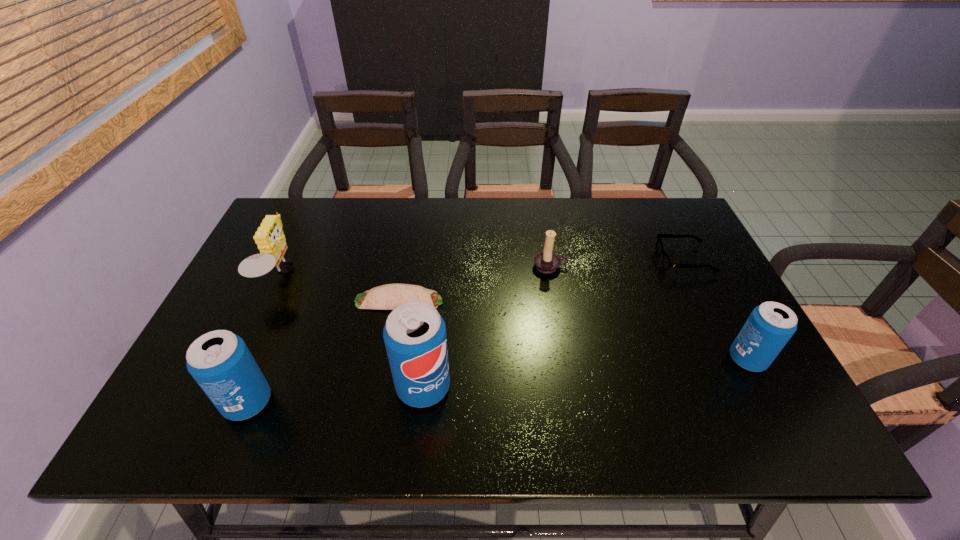
The height and width of the screenshot is (540, 960). In order to click on soda can identified as the second closest to the rightmost soda can in this screenshot , I will do `click(220, 362)`.

Identify which soda can is located as the second nearest to the burrito. Please provide its 2D coordinates. Your answer should be formatted as a tuple, i.e. [(x, y)], where the tuple contains the x and y coordinates of a point satisfying the conditions above.

[(220, 362)]

Where is `vacant space that satisfies the following two spatial constraints: 1. on the back side of the shortest soda can; 2. on the left side of the second soda can from right to left`? The width and height of the screenshot is (960, 540). vacant space that satisfies the following two spatial constraints: 1. on the back side of the shortest soda can; 2. on the left side of the second soda can from right to left is located at coordinates (426, 359).

Where is `free region that satisfies the following two spatial constraints: 1. on the wick of the candle holder; 2. at the bitten end of the shortest object`? Image resolution: width=960 pixels, height=540 pixels. free region that satisfies the following two spatial constraints: 1. on the wick of the candle holder; 2. at the bitten end of the shortest object is located at coordinates (556, 301).

Locate an element on the screen. vacant region that satisfies the following two spatial constraints: 1. on the wick of the fifth object from left to right; 2. on the front-facing side of the sponge is located at coordinates (552, 275).

The width and height of the screenshot is (960, 540). What are the coordinates of `vacant area in the image that satisfies the following two spatial constraints: 1. on the wick of the fifth object from left to right; 2. on the left side of the shortest soda can` in the screenshot? It's located at (566, 359).

This screenshot has width=960, height=540. In order to click on vacant space that satisfies the following two spatial constraints: 1. on the back side of the sixth shortest object; 2. on the right side of the second soda can from right to left in this screenshot , I will do `click(254, 387)`.

Identify the location of free space in the image that satisfies the following two spatial constraints: 1. at the bitten end of the second soda can from right to left; 2. on the right side of the burrito. (384, 387).

Where is `vacant region that satisfies the following two spatial constraints: 1. at the bitten end of the shortest object; 2. on the front side of the second shortest soda can`? This screenshot has width=960, height=540. vacant region that satisfies the following two spatial constraints: 1. at the bitten end of the shortest object; 2. on the front side of the second shortest soda can is located at coordinates (381, 402).

In order to click on vacant position in the image that satisfies the following two spatial constraints: 1. at the bitten end of the burrito; 2. on the back side of the rightmost soda can in this screenshot , I will do `click(389, 359)`.